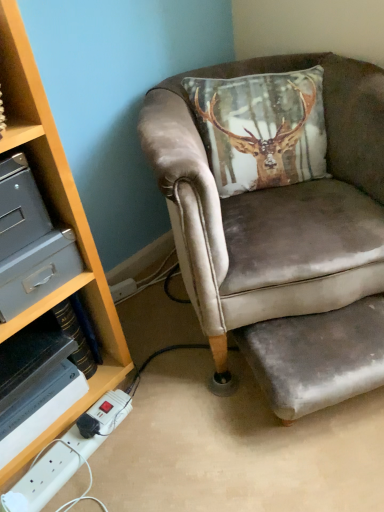
Locate an element on the screen. The image size is (384, 512). empty space that is to the right of white plastic power strip at lower left is located at coordinates (166, 441).